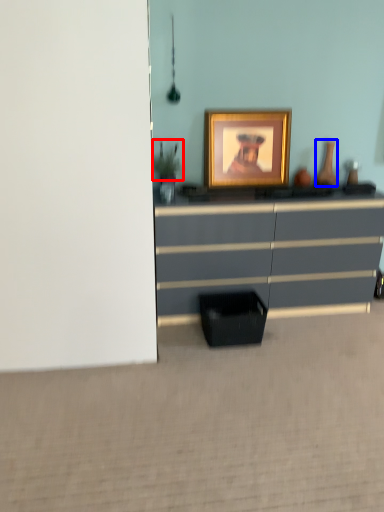
Question: Among these objects, which one is nearest to the camera, plant (highlighted by a red box) or vase (highlighted by a blue box)?

Choices:
 (A) plant
 (B) vase

Answer: (A)